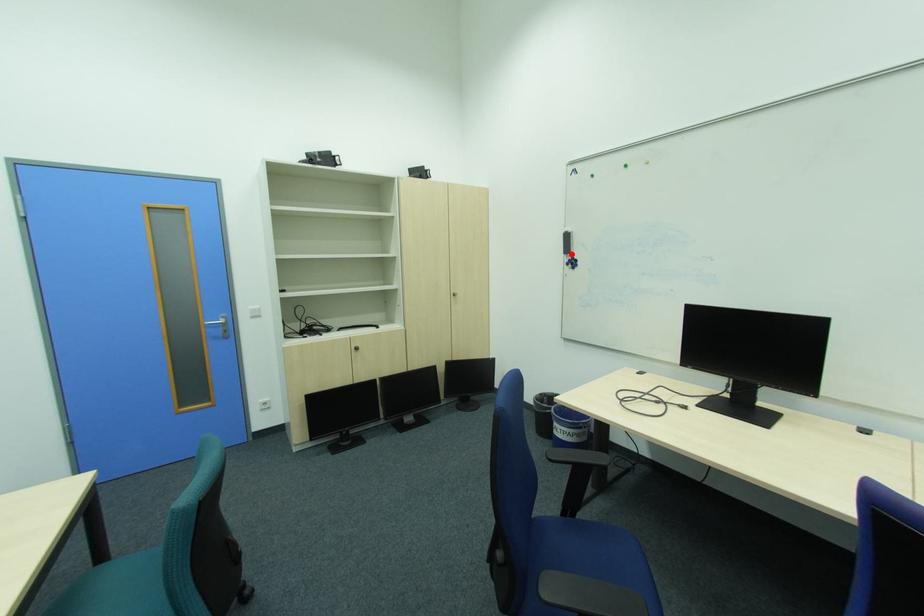
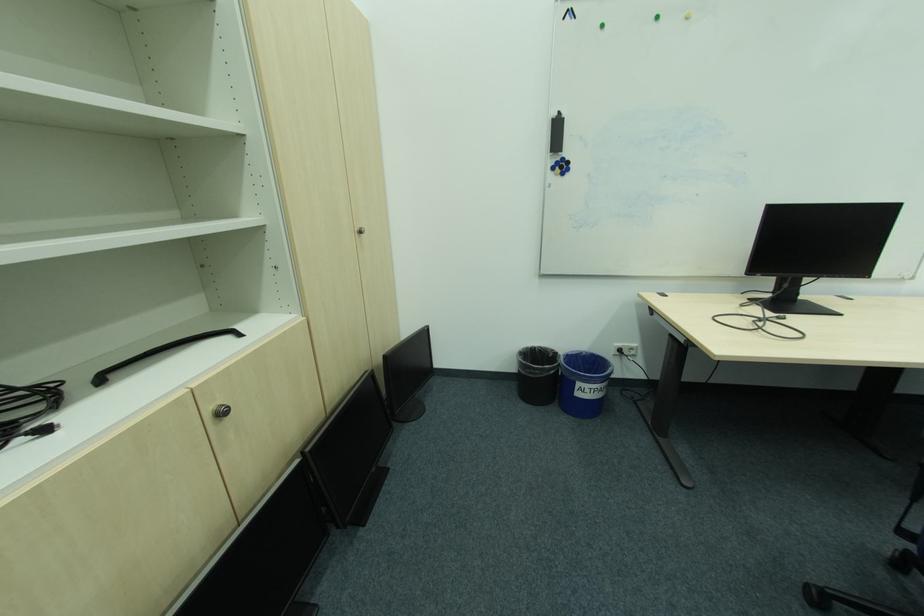
The point at the highlighted location is marked in the first image. Where is the corresponding point in the second image?

(558, 152)